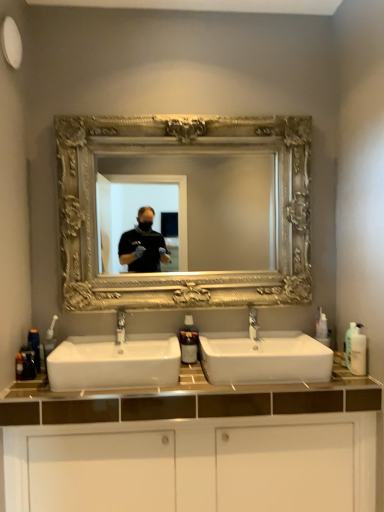
This screenshot has width=384, height=512. In order to click on free space in front of matte silver faucet at center, acting as the 2th tap starting from the right in this screenshot , I will do `click(117, 356)`.